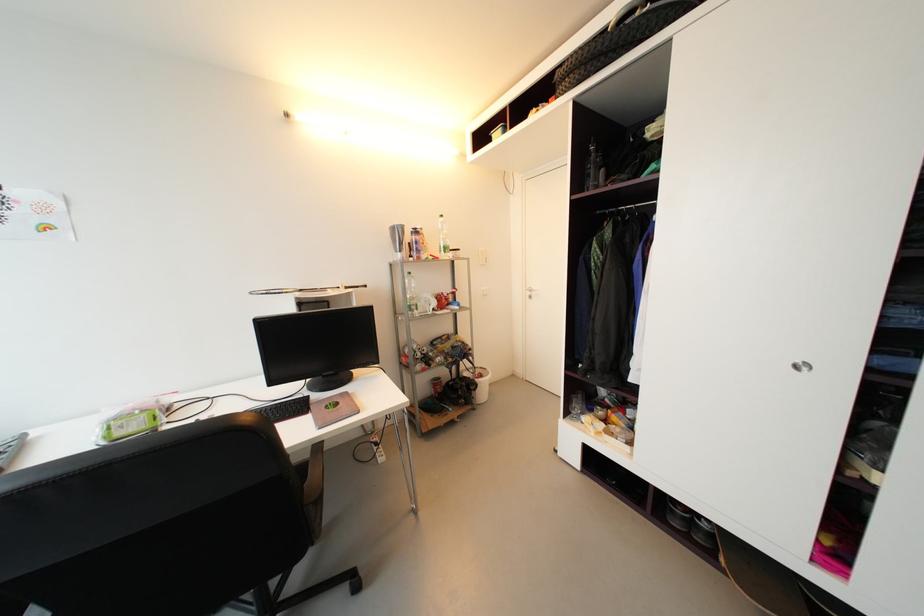
In order to click on chair armrest in this screenshot , I will do `click(312, 487)`.